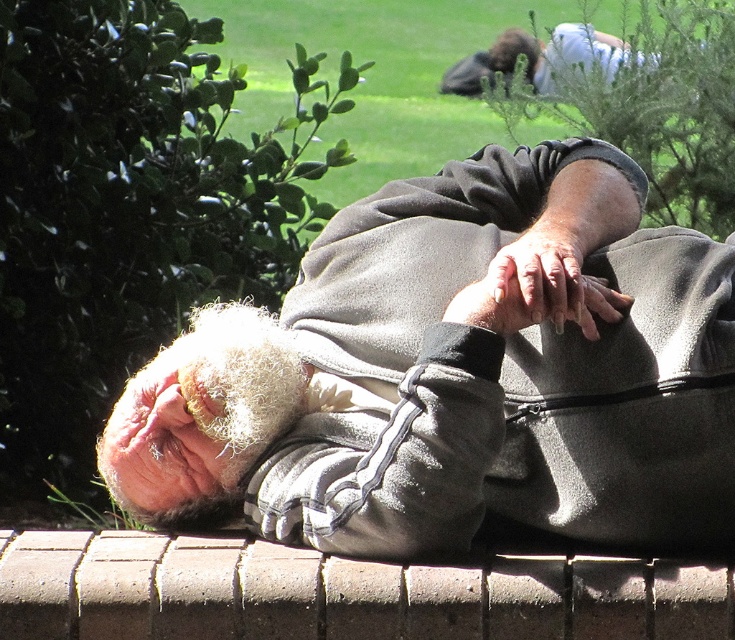
Question: Which point is closer to the camera taking this photo?

Choices:
 (A) [x=204, y=488]
 (B) [x=218, y=410]
 (C) [x=556, y=275]

Answer: (C)

Question: Which point appears closest to the camera in this image?

Choices:
 (A) (578, 282)
 (B) (112, 412)

Answer: (A)

Question: Where is gray fleece jacket at center located in relation to white fuzzy beard at center in the image?

Choices:
 (A) below
 (B) above

Answer: (B)

Question: Can you confirm if brick at lower center is thinner than white fuzzy beard at center?

Choices:
 (A) yes
 (B) no

Answer: (B)

Question: Estimate the real-world distances between objects in this image. Which object is farther from the white fuzzy beard at center?

Choices:
 (A) brick at lower center
 (B) dry skin at center

Answer: (B)

Question: In this image, where is brick at lower center located relative to white fuzzy beard at center?

Choices:
 (A) left
 (B) right

Answer: (B)